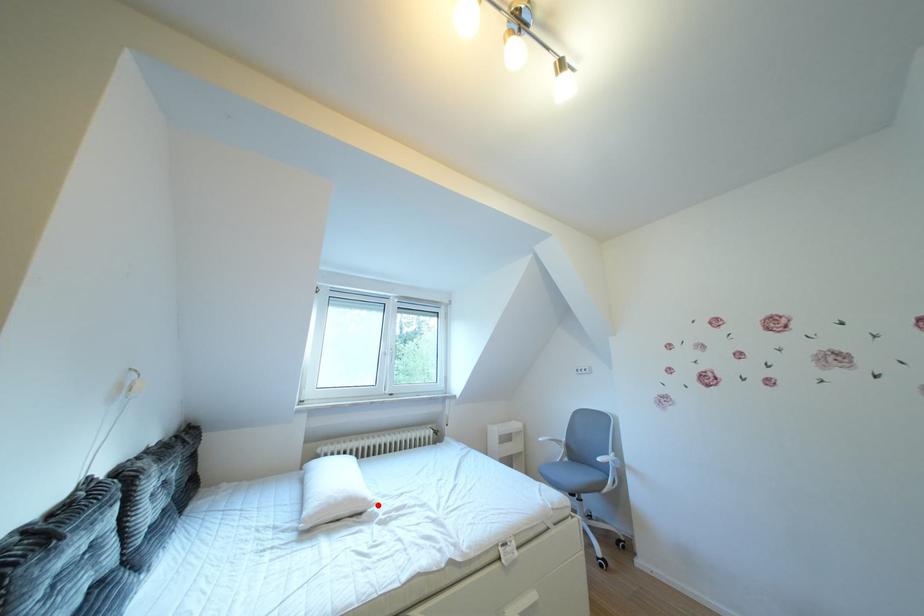
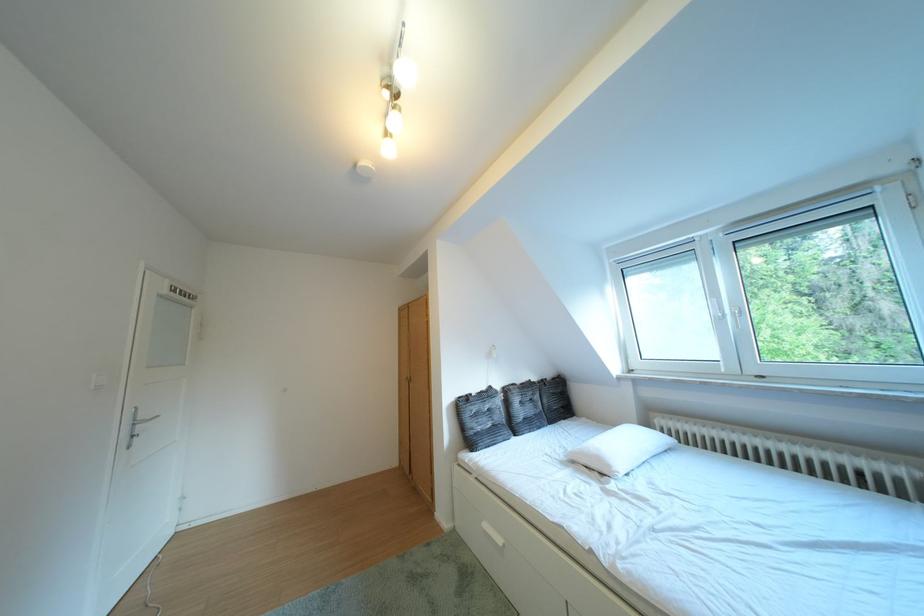
Locate, in the second image, the point that corresponds to the highlighted location in the first image.

(623, 471)